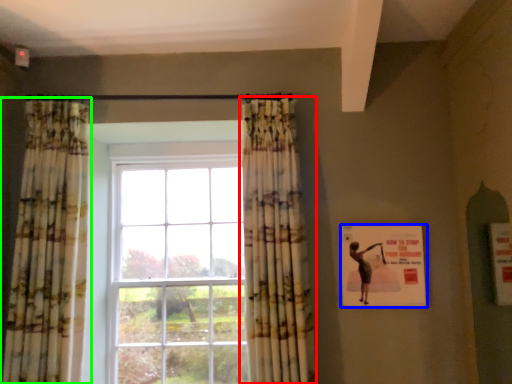
Question: Estimate the real-world distances between objects in this image. Which object is farther from curtain (highlighted by a red box), poster (highlighted by a blue box) or curtain (highlighted by a green box)?

Choices:
 (A) poster
 (B) curtain

Answer: (B)